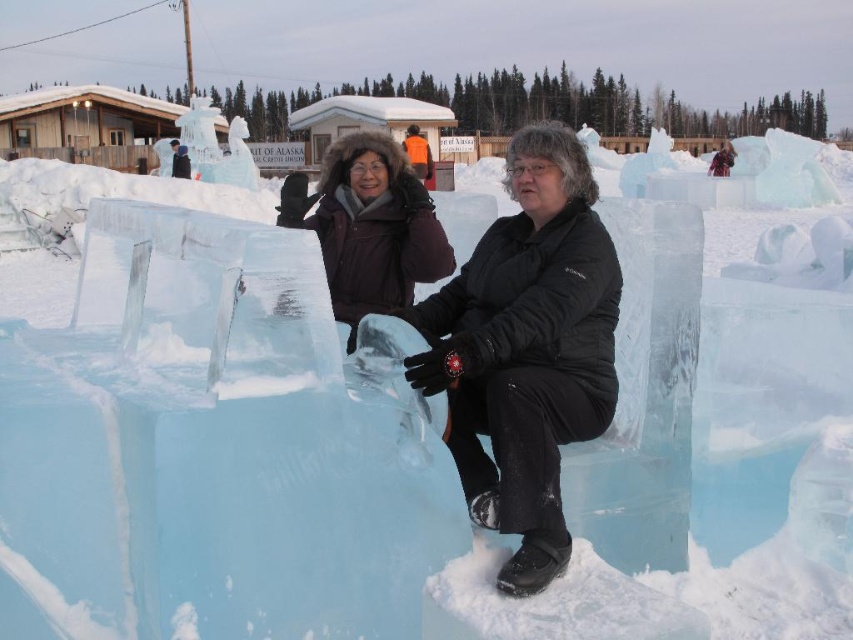
Does matte black jacket at center appear over orange fabric jacket at center?

No, matte black jacket at center is not above orange fabric jacket at center.

Locate an element on the screen. The image size is (853, 640). matte black jacket at center is located at coordinates (375, 228).

Between point (368, 288) and point (407, 150), which one is positioned behind?

The point (407, 150) is behind.

The height and width of the screenshot is (640, 853). I want to click on matte black jacket at center, so click(x=375, y=228).

Is transparent ice sculpture at center shorter than matte black jacket at center?

Incorrect, transparent ice sculpture at center's height does not fall short of matte black jacket at center's.

Who is lower down, transparent ice sculpture at center or matte black jacket at center?

Positioned lower is transparent ice sculpture at center.

This screenshot has height=640, width=853. I want to click on transparent ice sculpture at center, so coord(526,349).

Can you confirm if transparent ice sculpture at center is positioned below orange fabric jacket at center?

Yes, transparent ice sculpture at center is below orange fabric jacket at center.

Can you confirm if transparent ice sculpture at center is shorter than orange fabric jacket at center?

Yes, transparent ice sculpture at center is shorter than orange fabric jacket at center.

Is point (611, 264) more distant than point (410, 129)?

No.

This screenshot has width=853, height=640. I want to click on transparent ice sculpture at center, so click(526, 349).